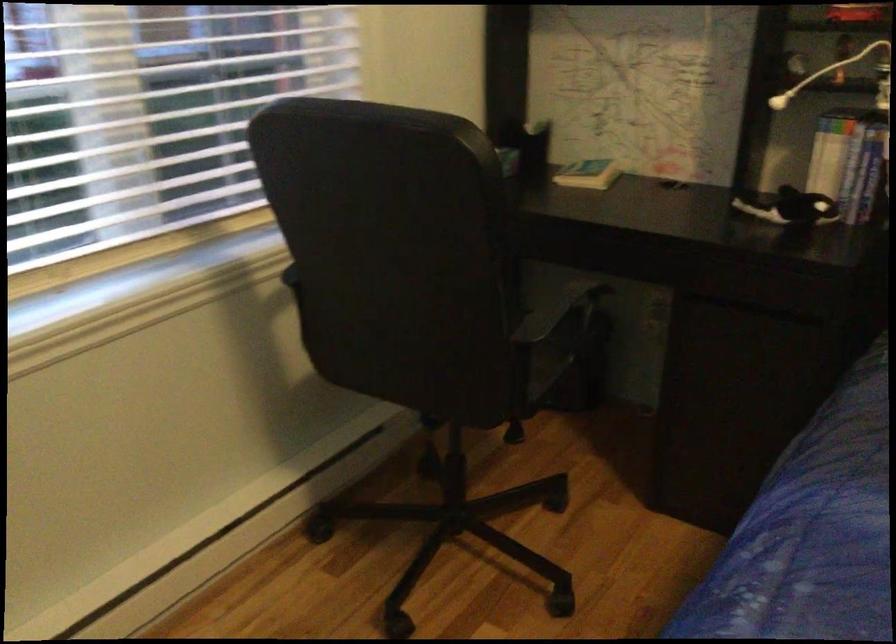
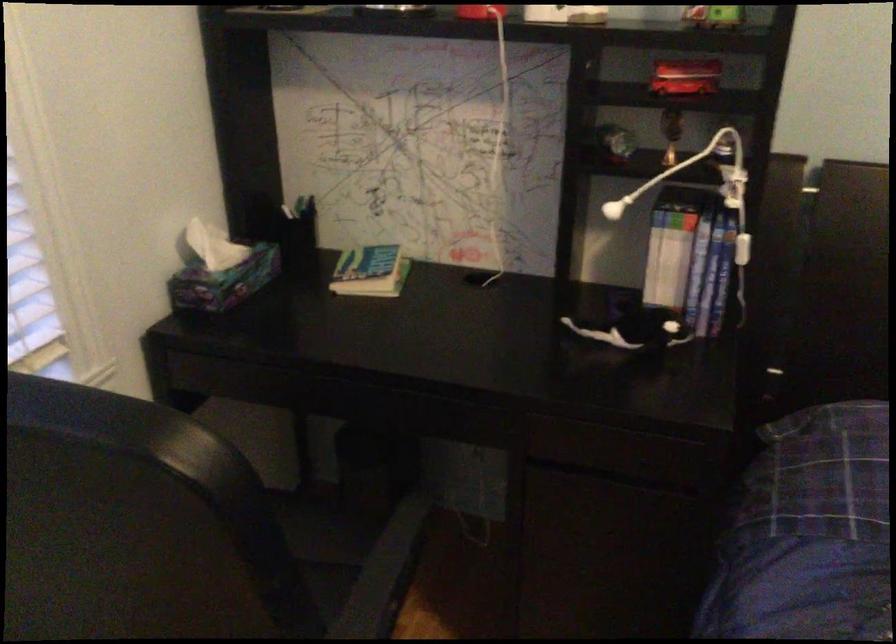
The point at (586, 169) is marked in the first image. Where is the corresponding point in the second image?

(371, 270)